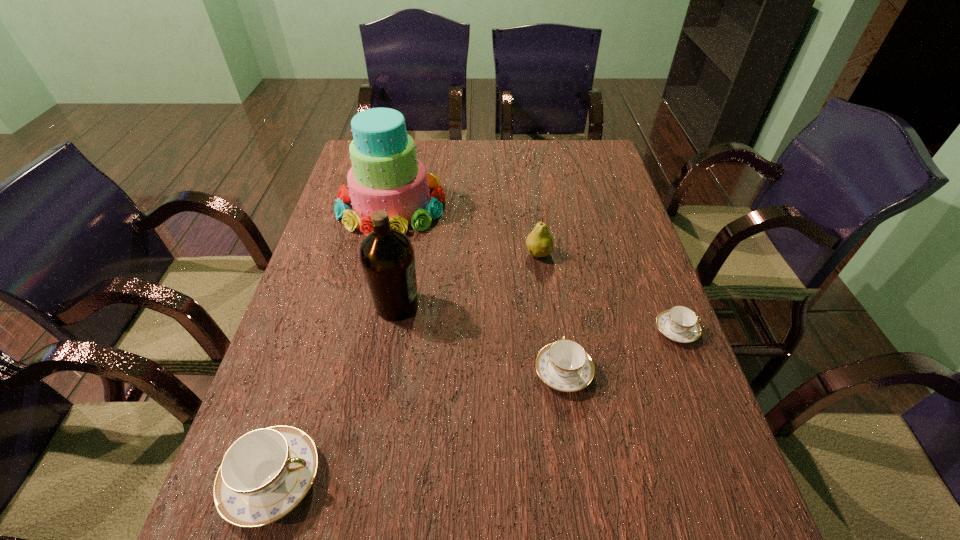
The width and height of the screenshot is (960, 540). I want to click on the nearest object, so click(266, 473).

Identify the location of the third shortest object. (266, 473).

Image resolution: width=960 pixels, height=540 pixels. Find the location of `the second shortest object`. the second shortest object is located at coordinates [x=565, y=366].

Where is `the second tallest teacup`? Image resolution: width=960 pixels, height=540 pixels. the second tallest teacup is located at coordinates (565, 366).

At what (x,y) coordinates should I click in order to perform the action: click on the shortest object. Please return your answer as a coordinate pair (x, y). This screenshot has height=540, width=960. Looking at the image, I should click on (680, 324).

Where is `the shortest teacup`? The image size is (960, 540). the shortest teacup is located at coordinates (680, 324).

This screenshot has width=960, height=540. What are the coordinates of `pear` in the screenshot? It's located at (539, 242).

The image size is (960, 540). In order to click on the fifth nearest object in this screenshot , I will do `click(539, 242)`.

Locate an element on the screen. This screenshot has width=960, height=540. cake is located at coordinates (386, 175).

Find the location of `olive oil`. olive oil is located at coordinates (387, 257).